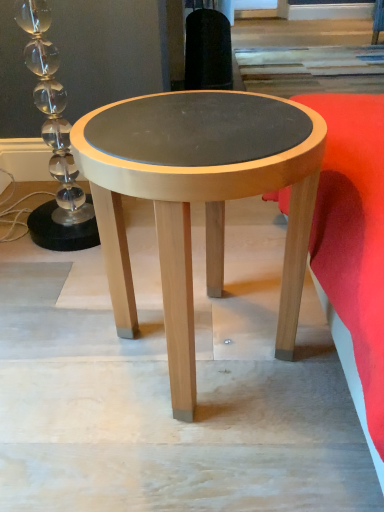
Describe the element at coordinates (197, 198) in the screenshot. The height and width of the screenshot is (512, 384). I see `matte wood coffee table at center` at that location.

Measure the distance between matte wood coffee table at center and camera.

matte wood coffee table at center is 20.48 inches from camera.

In order to face matte wood coffee table at center, should I rotate leftwards or rightwards?

Rotate your view right by about 1.298°.

In order to click on matte wood coffee table at center in this screenshot , I will do `click(197, 198)`.

At what (x,y) coordinates should I click in order to perform the action: click on velvet red cushion at lower right. Please return your answer as a coordinate pair (x, y). The width and height of the screenshot is (384, 512). Looking at the image, I should click on (353, 249).

What do you see at coordinates (353, 249) in the screenshot? I see `velvet red cushion at lower right` at bounding box center [353, 249].

Find the location of a particular element. This screenshot has width=384, height=512. matte wood coffee table at center is located at coordinates (197, 198).

Based on their positions, is velvet red cushion at lower right located to the left or right of matte wood coffee table at center?

Clearly, velvet red cushion at lower right is on the right of matte wood coffee table at center in the image.

Between velvet red cushion at lower right and matte wood coffee table at center, which one is positioned behind?

matte wood coffee table at center is further away from the camera.

Does point (348, 100) come farther from viewer compared to point (140, 189)?

Yes, point (348, 100) is farther from viewer.

From the image's perspective, which one is positioned lower, velvet red cushion at lower right or matte wood coffee table at center?

matte wood coffee table at center, from the image's perspective.

Looking at this image, from a real-world perspective, is velvet red cushion at lower right under matte wood coffee table at center?

Incorrect, from a real-world perspective, velvet red cushion at lower right is higher than matte wood coffee table at center.

Can you confirm if velvet red cushion at lower right is wider than matte wood coffee table at center?

Correct, the width of velvet red cushion at lower right exceeds that of matte wood coffee table at center.

Does velvet red cushion at lower right have a lesser height compared to matte wood coffee table at center?

Correct, velvet red cushion at lower right is not as tall as matte wood coffee table at center.

Considering the sizes of velvet red cushion at lower right and matte wood coffee table at center in the image, is velvet red cushion at lower right bigger or smaller than matte wood coffee table at center?

In the image, velvet red cushion at lower right appears to be larger than matte wood coffee table at center.

Is velvet red cushion at lower right not inside matte wood coffee table at center?

Yes, velvet red cushion at lower right is outside of matte wood coffee table at center.

Are velvet red cushion at lower right and matte wood coffee table at center far apart?

No, velvet red cushion at lower right is in close proximity to matte wood coffee table at center.

Is velvet red cushion at lower right aimed at matte wood coffee table at center?

No, velvet red cushion at lower right is not facing towards matte wood coffee table at center.

I want to click on bedding located above the matte wood coffee table at center (from a real-world perspective), so click(x=353, y=249).

Between matte wood coffee table at center and velvet red cushion at lower right, which one appears on the left side from the viewer's perspective?

Positioned to the left is matte wood coffee table at center.

Consider the image. Relative to velvet red cushion at lower right, is matte wood coffee table at center in front or behind?

matte wood coffee table at center is behind velvet red cushion at lower right.

Which is less distant, (118, 277) or (366, 138)?

The point (366, 138) is closer.

From the image's perspective, between matte wood coffee table at center and velvet red cushion at lower right, which one is located above?

velvet red cushion at lower right appears higher in the image.

From a real-world perspective, which is physically above, matte wood coffee table at center or velvet red cushion at lower right?

velvet red cushion at lower right.

Is matte wood coffee table at center wider than velvet red cushion at lower right?

Incorrect, the width of matte wood coffee table at center does not surpass that of velvet red cushion at lower right.

Does matte wood coffee table at center have a lesser height compared to velvet red cushion at lower right?

No, matte wood coffee table at center is not shorter than velvet red cushion at lower right.

Is matte wood coffee table at center bigger than velvet red cushion at lower right?

No, matte wood coffee table at center is not bigger than velvet red cushion at lower right.

Based on the photo, is velvet red cushion at lower right a part of matte wood coffee table at center?

No, matte wood coffee table at center does not contain velvet red cushion at lower right.

Does matte wood coffee table at center touch velvet red cushion at lower right?

matte wood coffee table at center and velvet red cushion at lower right are not in contact.

Is matte wood coffee table at center positioned with its back to velvet red cushion at lower right?

No, matte wood coffee table at center is not facing away from velvet red cushion at lower right.

Consider the image. Measure the distance from matte wood coffee table at center to velvet red cushion at lower right.

matte wood coffee table at center and velvet red cushion at lower right are 8.60 inches apart from each other.

Where is `coffee table lying behind the velvet red cushion at lower right`? coffee table lying behind the velvet red cushion at lower right is located at coordinates (197, 198).

Where is `coffee table to the left of velvet red cushion at lower right`? The height and width of the screenshot is (512, 384). coffee table to the left of velvet red cushion at lower right is located at coordinates (197, 198).

Locate an element on the screen. This screenshot has height=512, width=384. bedding above the matte wood coffee table at center (from a real-world perspective) is located at coordinates (353, 249).